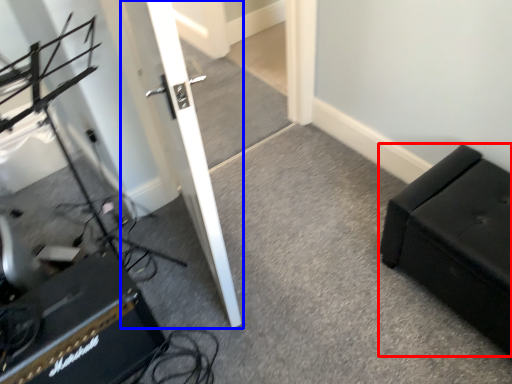
Question: Which of the following is the farthest to the observer, furniture (highlighted by a red box) or door (highlighted by a blue box)?

Choices:
 (A) furniture
 (B) door

Answer: (A)